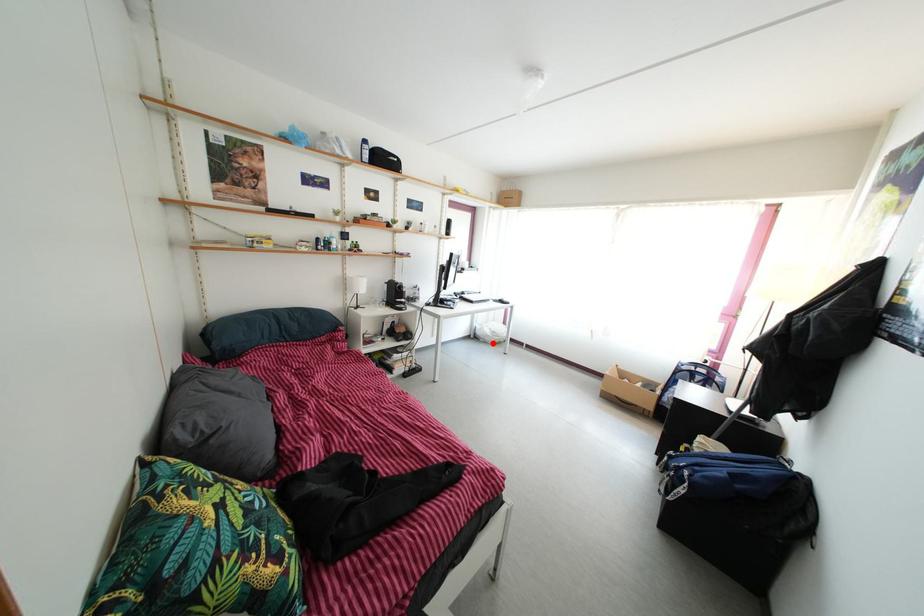
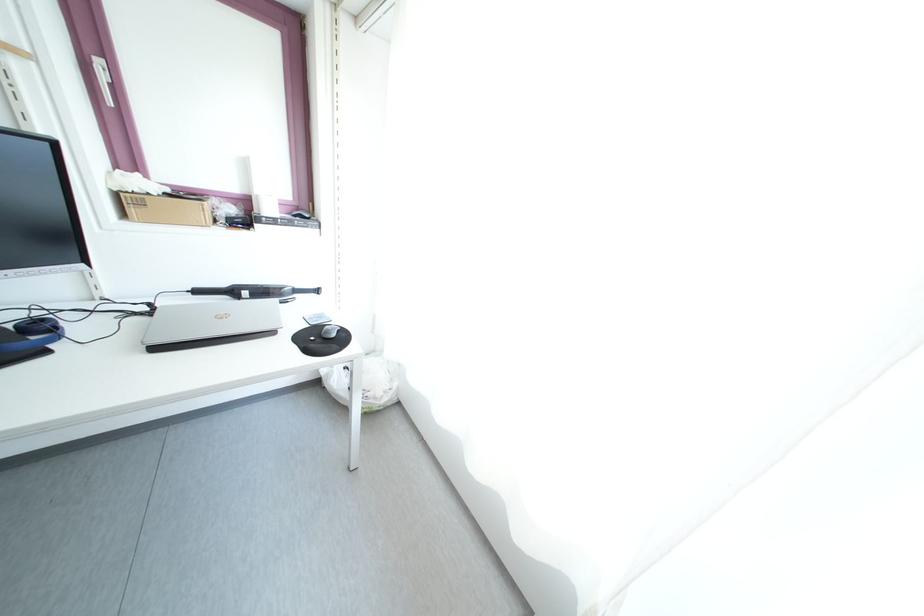
The point at the highlighted location is marked in the first image. Where is the corresponding point in the second image?

(344, 403)